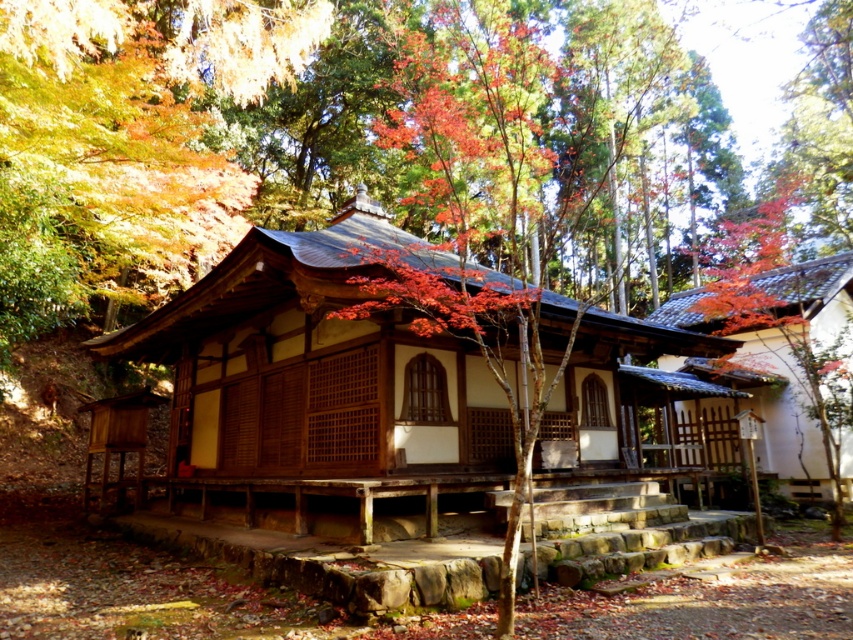
Question: Which point is farther from the camera taking this photo?

Choices:
 (A) (233, 273)
 (B) (788, 481)

Answer: (B)

Question: Does wooden hut at center appear under white matte wooden hut at center?

Choices:
 (A) no
 (B) yes

Answer: (A)

Question: Is wooden hut at center positioned in front of white matte wooden hut at center?

Choices:
 (A) yes
 (B) no

Answer: (A)

Question: Which point is farther to the camera?

Choices:
 (A) 202,307
 (B) 814,467

Answer: (B)

Question: Can you confirm if wooden hut at center is smaller than white matte wooden hut at center?

Choices:
 (A) yes
 (B) no

Answer: (B)